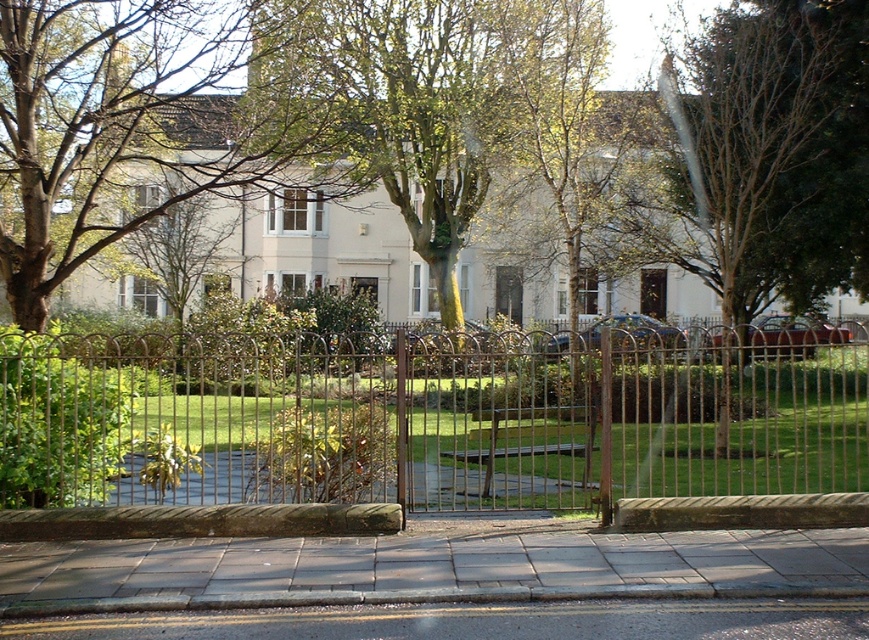
You are standing at the curb in front of the open gate of the residential area. You see a point marked at coordinates point (425, 568). What is the location of this point relative to the gray concrete pavement at center?

The point (425, 568) corresponds to the gray concrete pavement at center, so it is located directly on the gray concrete pavement at center.

You are a delivery person approaching the brown wooden door at center. You need to park your delivery van on the gray concrete pavement at lower center. Can you fit your van there if the van is 2 meters long?

The gray concrete pavement at lower center is shorter than the brown wooden door at center. Since the brown wooden door at center is likely taller than 2 meters, the pavement might not be long enough to accommodate the van. However, without exact measurements, it is uncertain. Please check the actual length of the pavement before deciding.

You are a delivery person approaching the brown wooden door at center. You need to place a package on the gray concrete pavement at lower center. Can you reach the pavement directly from the road without stepping onto the grass?

The gray concrete pavement at lower center is in front of the brown wooden door at center, so yes, you can reach the gray concrete pavement at lower center directly from the road without needing to step onto the grass since it is paved and accessible.